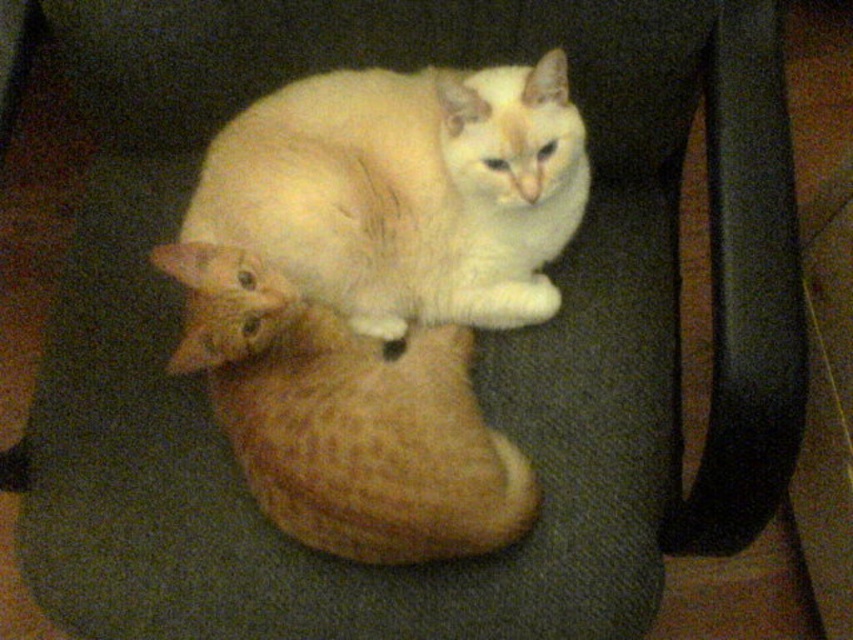
Can you confirm if soft cream fur cat at center is positioned below white fluffy cat at center?

Actually, soft cream fur cat at center is above white fluffy cat at center.

Which is more to the left, soft cream fur cat at center or white fluffy cat at center?

white fluffy cat at center is more to the left.

Does point (190, 280) come closer to viewer compared to point (410, 484)?

No, (190, 280) is behind (410, 484).

Locate an element on the screen. This screenshot has height=640, width=853. soft cream fur cat at center is located at coordinates (401, 193).